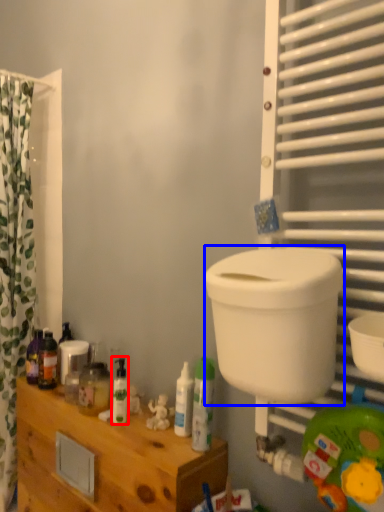
Question: Among these objects, which one is farthest to the camera, toiletry (highlighted by a red box) or toilet bowl (highlighted by a blue box)?

Choices:
 (A) toiletry
 (B) toilet bowl

Answer: (A)